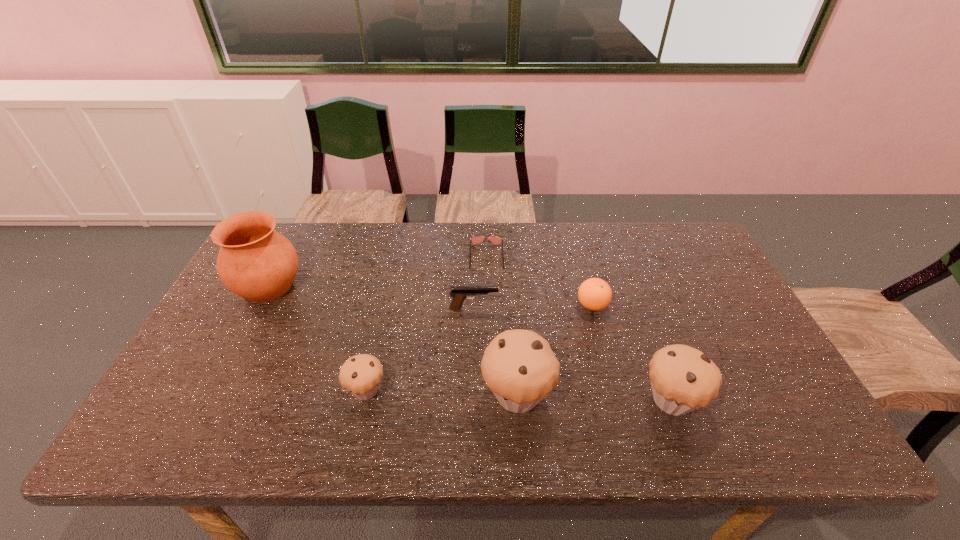
Image resolution: width=960 pixels, height=540 pixels. I want to click on vacant space that satisfies the following two spatial constraints: 1. at the muzzle of the pistol; 2. on the right side of the rightmost object, so click(x=472, y=399).

You are a GUI agent. You are given a task and a screenshot of the screen. Output one action in this format:
    pyautogui.click(x=<x>, y=<y>)
    Task: Click on the vacant position in the image that satisfies the following two spatial constraints: 1. on the bridge of the sunglasses; 2. on the left side of the second muffin from right to left
    
    Given the screenshot: What is the action you would take?
    pyautogui.click(x=489, y=395)

In order to click on free region that satisfies the following two spatial constraints: 1. on the bridge of the sunglasses; 2. on the right side of the second muffin from right to left in this screenshot , I will do pyautogui.click(x=489, y=395).

Find the location of a particular element. The width and height of the screenshot is (960, 540). blank space that satisfies the following two spatial constraints: 1. on the front side of the sixth object from left to right; 2. at the muzzle of the pistol is located at coordinates (593, 308).

In order to click on free space that satisfies the following two spatial constraints: 1. on the back side of the leftmost muffin; 2. on the right side of the sixth object from left to right in this screenshot , I will do `click(385, 306)`.